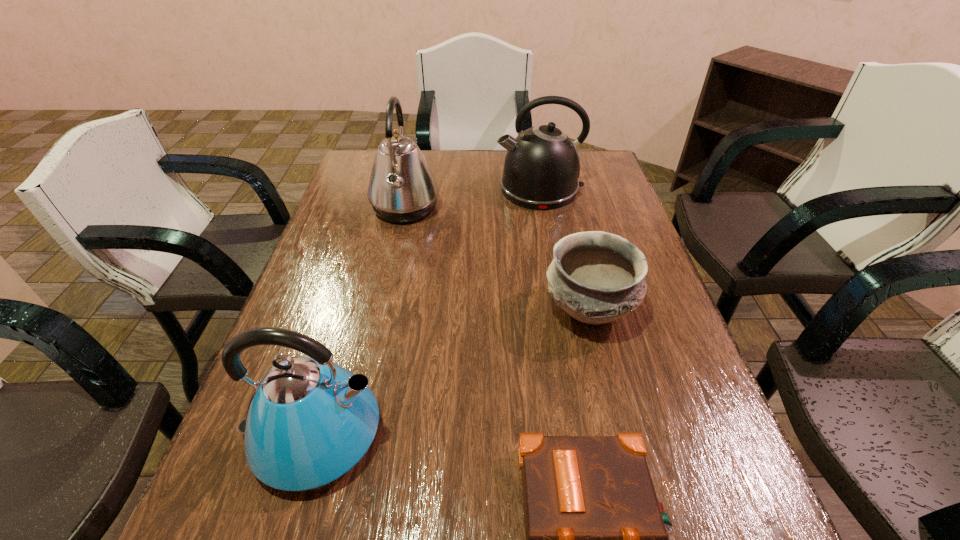
What are the coordinates of `the rightmost kettle` in the screenshot? It's located at (542, 166).

At what (x,y) coordinates should I click in order to perform the action: click on the nearest kettle. Please return your answer as a coordinate pair (x, y). This screenshot has width=960, height=540. Looking at the image, I should click on (309, 420).

Where is `pottery`? The height and width of the screenshot is (540, 960). pottery is located at coordinates (596, 277).

The image size is (960, 540). I want to click on the third nearest object, so click(x=596, y=277).

You are a GUI agent. You are given a task and a screenshot of the screen. Output one action in this format:
    pyautogui.click(x=<x>, y=<y>)
    Task: Click on the free space located on the spout of the rightmost kettle
    The height and width of the screenshot is (540, 960).
    Given the screenshot: What is the action you would take?
    pyautogui.click(x=468, y=189)

The height and width of the screenshot is (540, 960). I want to click on vacant area situated 0.310m on the spout of the rightmost kettle, so click(x=401, y=189).

Image resolution: width=960 pixels, height=540 pixels. I want to click on free region located on the spout of the rightmost kettle, so click(422, 189).

This screenshot has height=540, width=960. What are the coordinates of `free region located 0.260m at the spout of the nearest kettle` in the screenshot? It's located at (522, 434).

Identify the location of vacant space situated 0.360m on the front of the third farthest object. (640, 524).

I want to click on object present at the far edge, so click(542, 166).